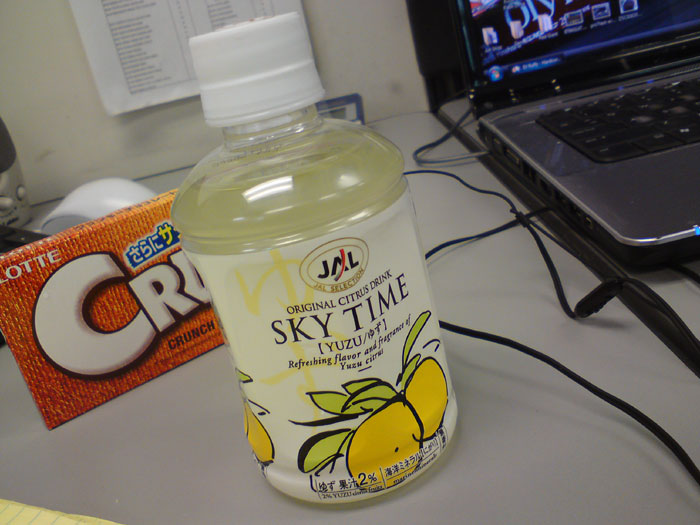
This screenshot has width=700, height=525. What are the coordinates of `desktop` in the screenshot? It's located at (528, 470).